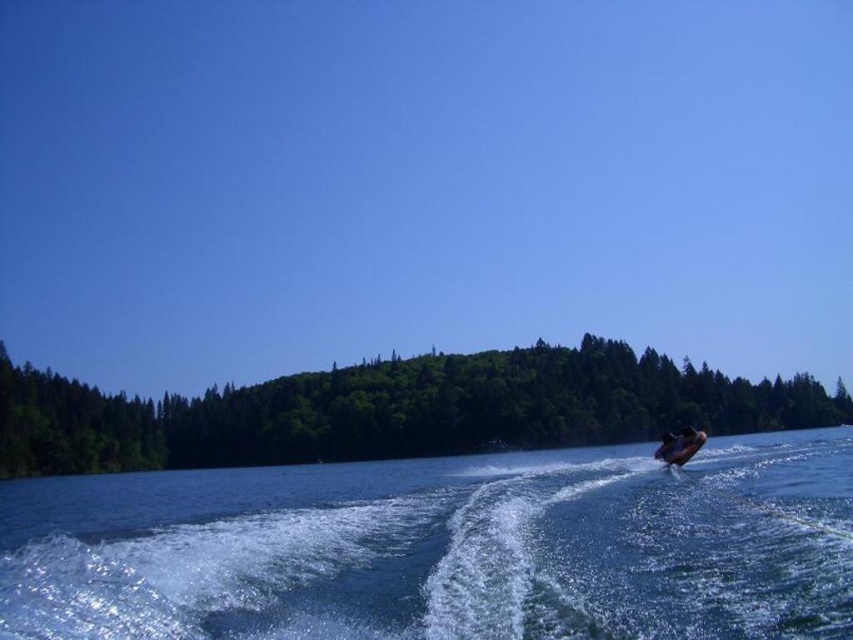
Is clear blue water at lower right wider than green leafy trees at center?

No.

Looking at this image, is clear blue water at lower right above green leafy trees at center?

No, clear blue water at lower right is not above green leafy trees at center.

At what (x,y) coordinates should I click in order to perform the action: click on clear blue water at lower right. Please return your answer as a coordinate pair (x, y). The image size is (853, 640). Looking at the image, I should click on (444, 547).

Does clear blue water at lower right have a lesser height compared to shiny metallic jet ski at lower right?

Incorrect, clear blue water at lower right's height does not fall short of shiny metallic jet ski at lower right's.

Does clear blue water at lower right have a greater height compared to shiny metallic jet ski at lower right?

Yes, clear blue water at lower right is taller than shiny metallic jet ski at lower right.

Is point (407, 545) positioned behind point (666, 440)?

No, (407, 545) is in front of (666, 440).

Locate an element on the screen. clear blue water at lower right is located at coordinates (444, 547).

Which is below, green leafy trees at center or shiny metallic jet ski at lower right?

green leafy trees at center is lower down.

Is green leafy trees at center further to camera compared to shiny metallic jet ski at lower right?

Yes, it is behind shiny metallic jet ski at lower right.

Measure the distance between green leafy trees at center and camera.

They are 652.27 feet apart.

At what (x,y) coordinates should I click in order to perform the action: click on green leafy trees at center. Please return your answer as a coordinate pair (x, y). The image size is (853, 640). Looking at the image, I should click on (395, 410).